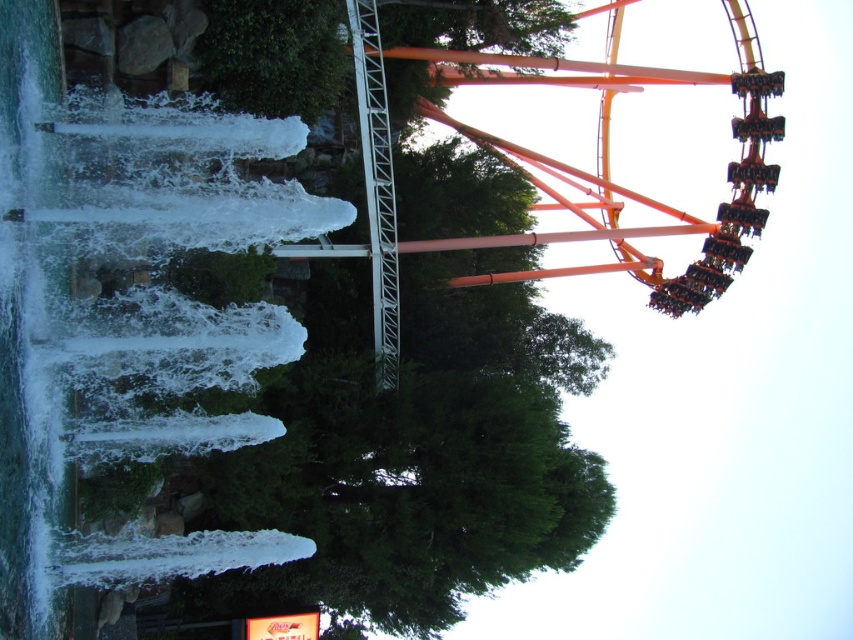
This screenshot has width=853, height=640. I want to click on green leafy tree at center, so click(415, 452).

Does green leafy tree at center appear on the left side of orange metallic roller coaster at upper right?

Yes, green leafy tree at center is to the left of orange metallic roller coaster at upper right.

This screenshot has width=853, height=640. What are the coordinates of `green leafy tree at center` in the screenshot? It's located at (415, 452).